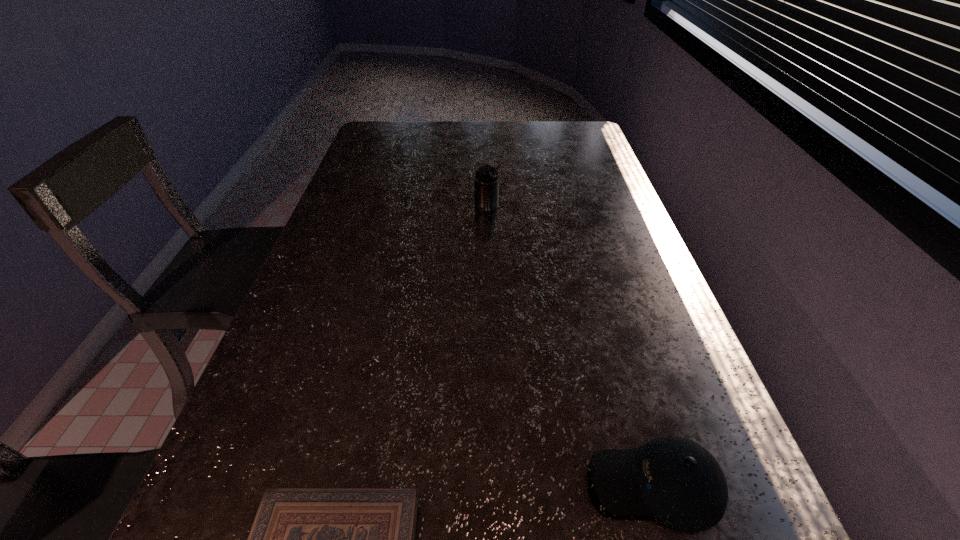
This screenshot has width=960, height=540. Find the location of `vacant space at the left edge of the desktop`. vacant space at the left edge of the desktop is located at coordinates (256, 405).

Locate an element on the screen. This screenshot has height=540, width=960. free spot at the right edge of the desktop is located at coordinates (602, 191).

At what (x,y) coordinates should I click in order to perform the action: click on vacant space at the far left corner of the desktop. Please return your answer as a coordinate pair (x, y). This screenshot has height=540, width=960. Looking at the image, I should click on (402, 137).

Find the location of a particular element. The image size is (960, 540). free point between the can and the rightmost object is located at coordinates (571, 345).

The width and height of the screenshot is (960, 540). Find the location of `free space between the second object from right to left and the rightmost object`. free space between the second object from right to left and the rightmost object is located at coordinates (571, 345).

Where is `empty location between the rightmost object and the farthest object`? This screenshot has width=960, height=540. empty location between the rightmost object and the farthest object is located at coordinates 571,345.

Locate an element on the screen. The height and width of the screenshot is (540, 960). the closest object to the rightmost object is located at coordinates (302, 539).

Identify which object is the closest to the Bible. Please provide its 2D coordinates. Your answer should be formatted as a tuple, i.e. [(x, y)], where the tuple contains the x and y coordinates of a point satisfying the conditions above.

[(674, 479)]